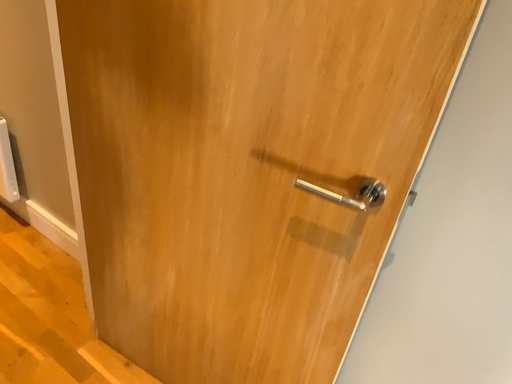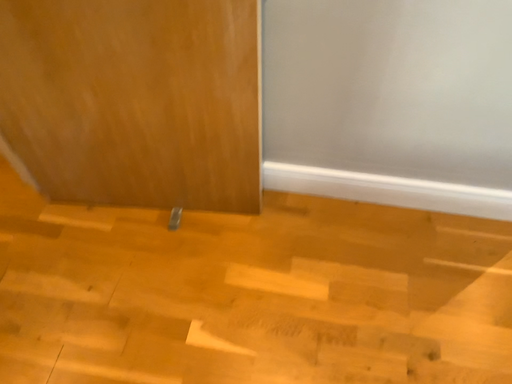
Question: Which way did the camera rotate in the video?

Choices:
 (A) rotated downward
 (B) rotated upward

Answer: (A)